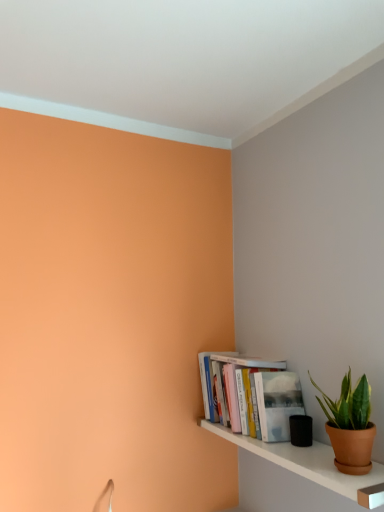
Question: Is green matte plant pot at lower right far from white glossy shelf at lower right?

Choices:
 (A) yes
 (B) no

Answer: (B)

Question: Does green matte plant pot at lower right have a greater width compared to white glossy shelf at lower right?

Choices:
 (A) yes
 (B) no

Answer: (B)

Question: Considering the relative positions of green matte plant pot at lower right and white glossy shelf at lower right in the image provided, is green matte plant pot at lower right to the right of white glossy shelf at lower right from the viewer's perspective?

Choices:
 (A) no
 (B) yes

Answer: (B)

Question: Is green matte plant pot at lower right shorter than white glossy shelf at lower right?

Choices:
 (A) yes
 (B) no

Answer: (B)

Question: From a real-world perspective, is green matte plant pot at lower right under white glossy shelf at lower right?

Choices:
 (A) no
 (B) yes

Answer: (A)

Question: From the image's perspective, is green matte plant pot at lower right above or below hardcover books at lower right?

Choices:
 (A) below
 (B) above

Answer: (B)

Question: In terms of height, does green matte plant pot at lower right look taller or shorter compared to hardcover books at lower right?

Choices:
 (A) short
 (B) tall

Answer: (A)

Question: Considering the positions of green matte plant pot at lower right and hardcover books at lower right in the image, is green matte plant pot at lower right wider or thinner than hardcover books at lower right?

Choices:
 (A) thin
 (B) wide

Answer: (A)

Question: In the image, is green matte plant pot at lower right on the left side or the right side of hardcover books at lower right?

Choices:
 (A) right
 (B) left

Answer: (A)

Question: Based on their sizes in the image, would you say green matte plant pot at lower right is bigger or smaller than white glossy shelf at lower right?

Choices:
 (A) big
 (B) small

Answer: (B)

Question: In terms of width, does green matte plant pot at lower right look wider or thinner when compared to white glossy shelf at lower right?

Choices:
 (A) wide
 (B) thin

Answer: (B)

Question: Considering their positions, is green matte plant pot at lower right located in front of or behind white glossy shelf at lower right?

Choices:
 (A) behind
 (B) front

Answer: (A)

Question: From a real-world perspective, is green matte plant pot at lower right physically located above or below white glossy shelf at lower right?

Choices:
 (A) above
 (B) below

Answer: (A)

Question: From a real-world perspective, is white glossy shelf at lower right positioned above or below hardcover books at lower right?

Choices:
 (A) below
 (B) above

Answer: (A)

Question: Is white glossy shelf at lower right spatially inside hardcover books at lower right, or outside of it?

Choices:
 (A) outside
 (B) inside

Answer: (A)